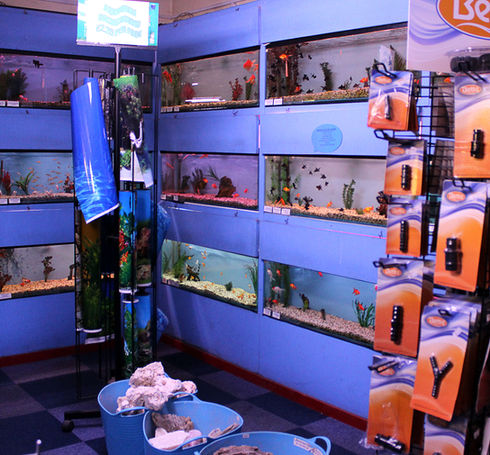
The height and width of the screenshot is (455, 490). I want to click on tank part on shelf, so click(x=392, y=100), click(x=409, y=174), click(x=407, y=231), click(x=404, y=308), click(x=380, y=422), click(x=464, y=351), click(x=472, y=254), click(x=469, y=153).